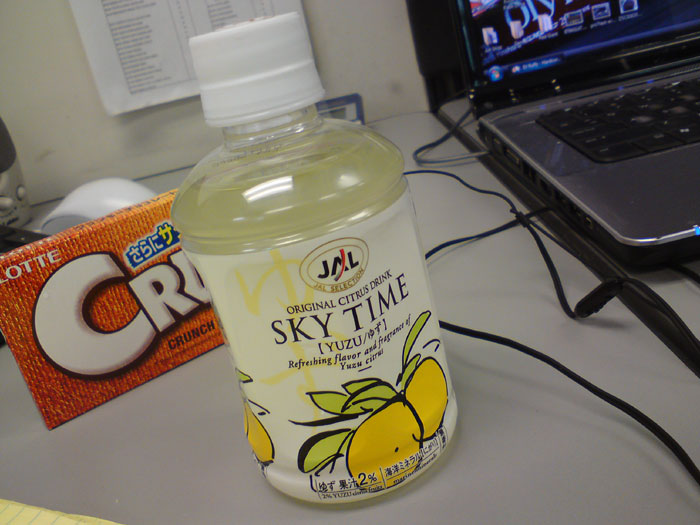
Locate an element on the screen. This screenshot has height=525, width=700. speaker buttons is located at coordinates (22, 192), (7, 205).